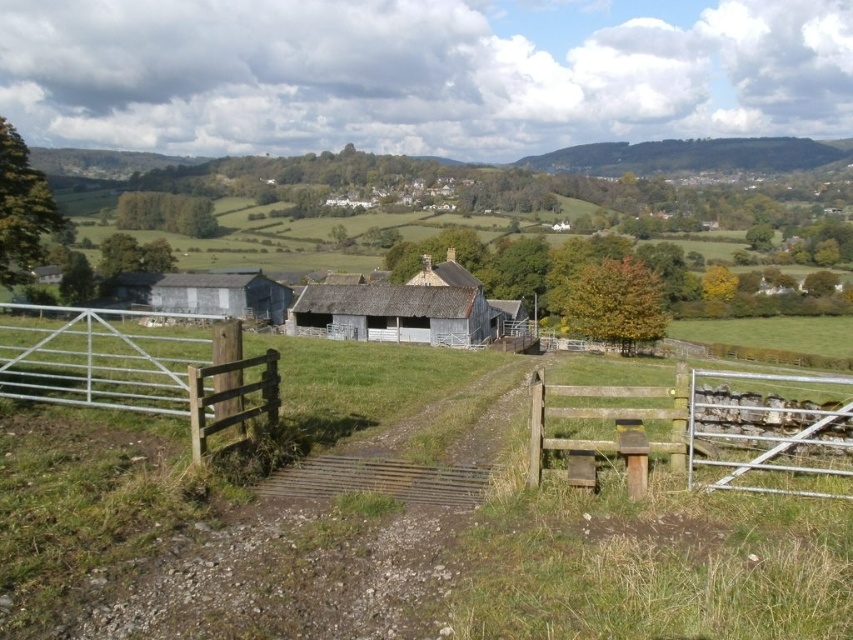
Can you confirm if metallic silver gate at left is bigger than weathered wood barn at center?

Correct, metallic silver gate at left is larger in size than weathered wood barn at center.

Is metallic silver gate at left smaller than weathered wood barn at center?

Incorrect, metallic silver gate at left is not smaller in size than weathered wood barn at center.

Is point (236, 332) farther from camera compared to point (454, 294)?

That is False.

Where is `metallic silver gate at left`? Image resolution: width=853 pixels, height=640 pixels. metallic silver gate at left is located at coordinates (136, 371).

Is green grassy at center behind brown wooden fence at lower right?

No, it is not.

Does point (457, 380) come in front of point (556, 444)?

No, (457, 380) is behind (556, 444).

What do you see at coordinates (488, 540) in the screenshot? I see `green grassy at center` at bounding box center [488, 540].

You are a GUI agent. You are given a task and a screenshot of the screen. Output one action in this format:
    pyautogui.click(x=<x>, y=<y>)
    Task: Click on the green grassy at center
    Image resolution: width=853 pixels, height=640 pixels.
    Given the screenshot: What is the action you would take?
    pyautogui.click(x=488, y=540)

Who is more distant from viewer, (693, 586) or (146, 288)?

The point (146, 288) is behind.

Which is below, green grassy at center or weathered gray barn at left?

green grassy at center

Where is `green grassy at center`? The height and width of the screenshot is (640, 853). green grassy at center is located at coordinates (488, 540).

Where is `green grassy at center`? This screenshot has width=853, height=640. green grassy at center is located at coordinates (488, 540).